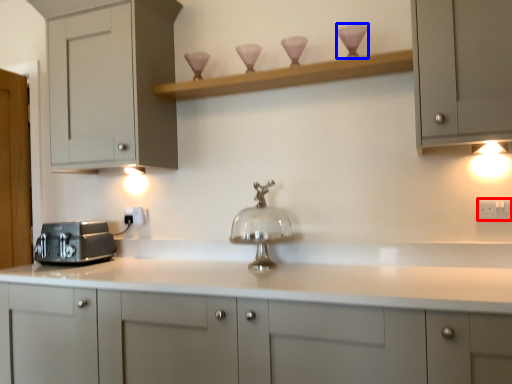
Question: Which of the following is the closest to the observer, electric outlet (highlighted by a red box) or candle holder (highlighted by a blue box)?

Choices:
 (A) electric outlet
 (B) candle holder

Answer: (A)